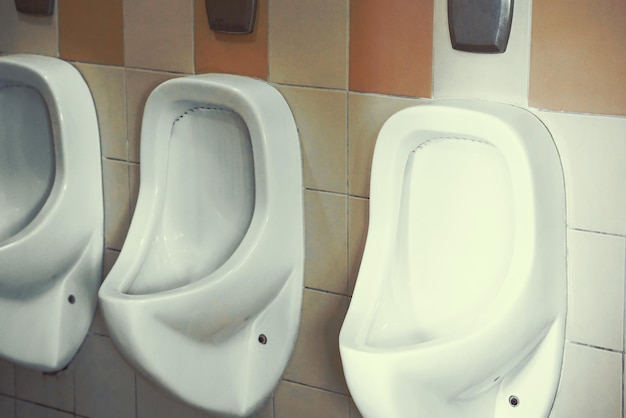
Find the location of a particular element. This screenshot has height=418, width=626. dark tiles is located at coordinates (581, 46), (411, 24), (235, 51), (74, 43).